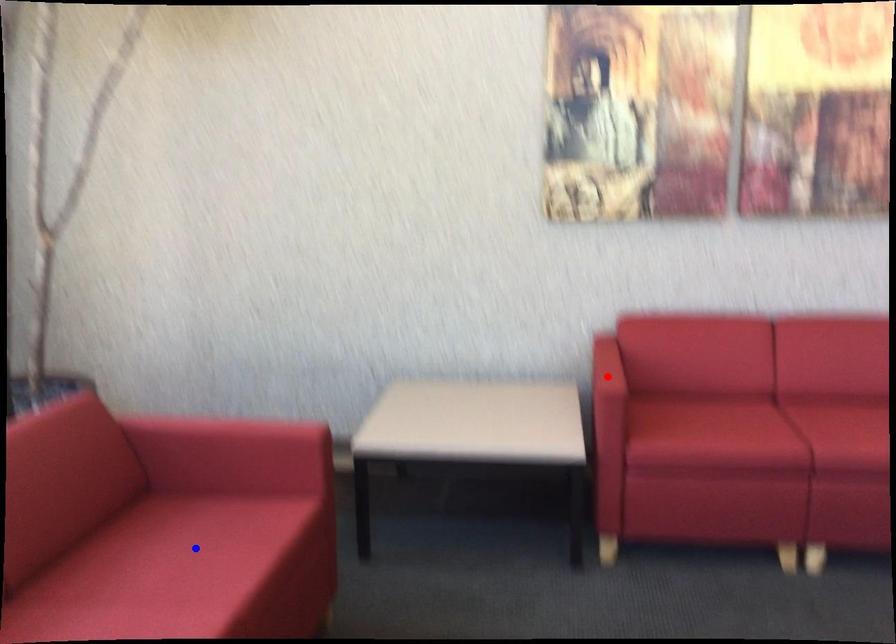
Question: Which of the two points in the image is closer to the camera?

Choices:
 (A) Blue point is closer.
 (B) Red point is closer.

Answer: (A)